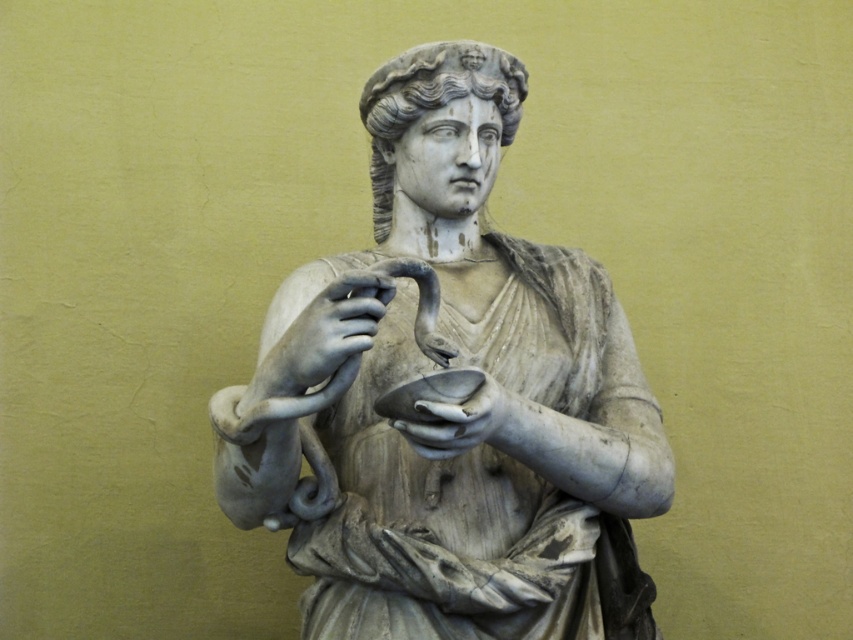
You are an art conservator examining the statue. You need to clean the white marble snake at center and the white marble hand at center. Based on their positions, which object should you clean first to avoid getting the other object dirty?

The white marble snake at center is in front of white marble hand at center, so you should clean the white marble snake at center first to avoid splashing water or cleaning solution onto the hand behind it.

You are an art conservator examining the classical marble statue. You notice the white marble snake at center and the white marble statue at center. Which object is positioned closer to the viewer?

The white marble statue at center is closer to the viewer because the white marble snake at center is behind it.